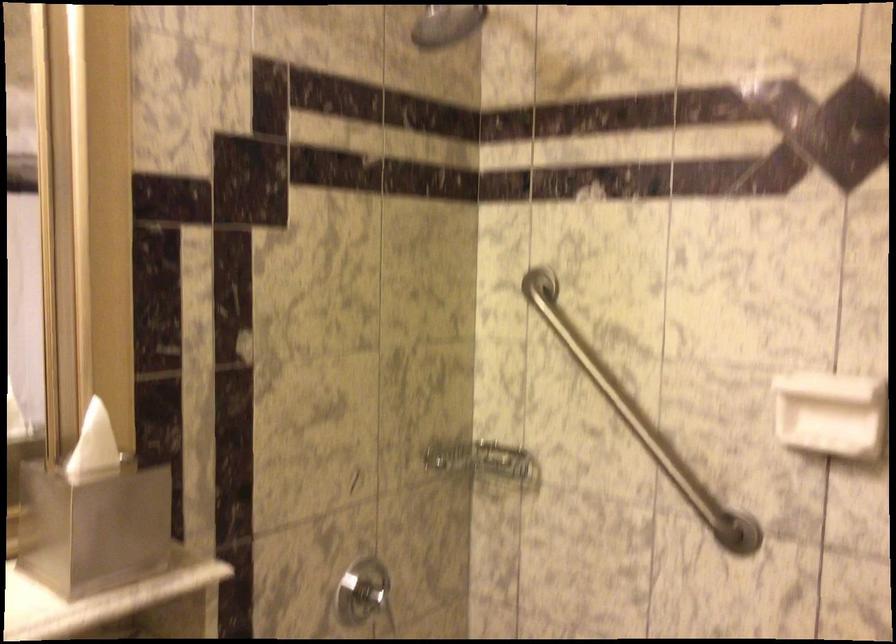
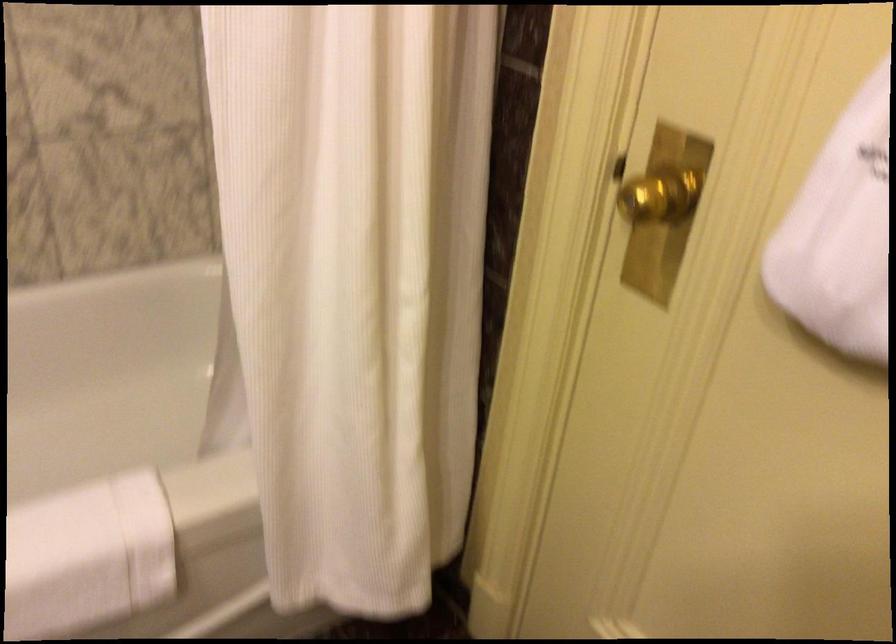
Consider the image. The first image is from the beginning of the video and the second image is from the end. How did the camera likely rotate when shooting the video?

The camera's rotation is toward right-down.